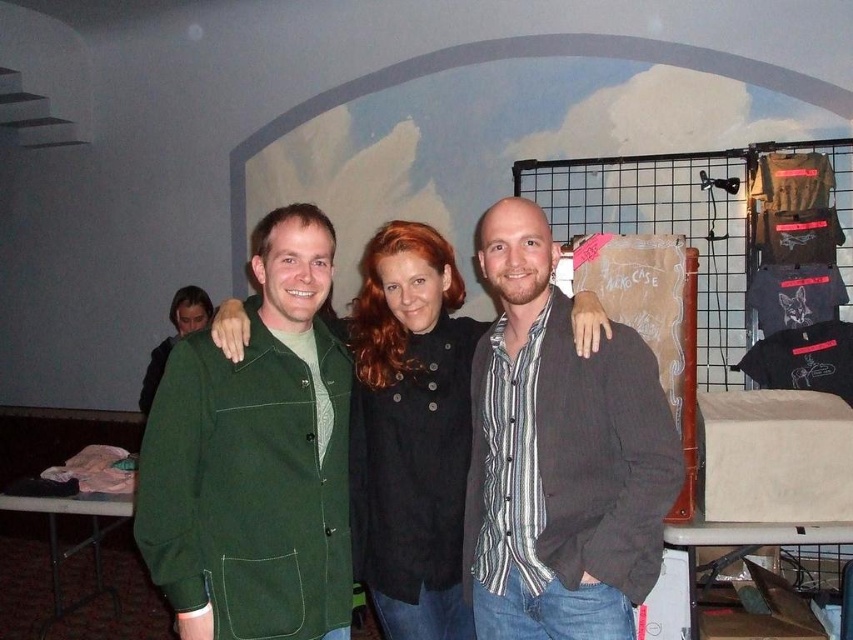
Between green corduroy jacket at center and matte green jacket at left, which one appears on the left side from the viewer's perspective?

matte green jacket at left

Between point (152, 534) and point (193, 324), which one is positioned behind?

Point (193, 324)

Find the location of a particular element. This screenshot has height=640, width=853. green corduroy jacket at center is located at coordinates (254, 458).

Who is more distant from viewer, (531, 500) or (181, 305)?

Positioned behind is point (181, 305).

Between point (578, 500) and point (207, 301), which one is positioned in front?

Positioned in front is point (578, 500).

Locate an element on the screen. The width and height of the screenshot is (853, 640). striped cotton shirt at center is located at coordinates (560, 456).

Does striped cotton shirt at center have a greater width compared to black matte jacket at center?

Indeed, striped cotton shirt at center has a greater width compared to black matte jacket at center.

Which is more to the left, striped cotton shirt at center or black matte jacket at center?

Positioned to the left is black matte jacket at center.

Is point (624, 540) farther from camera compared to point (596, 312)?

No, it is not.

Find the location of a particular element. This screenshot has width=853, height=640. striped cotton shirt at center is located at coordinates (560, 456).